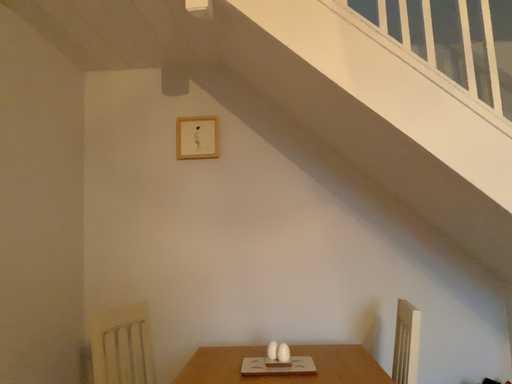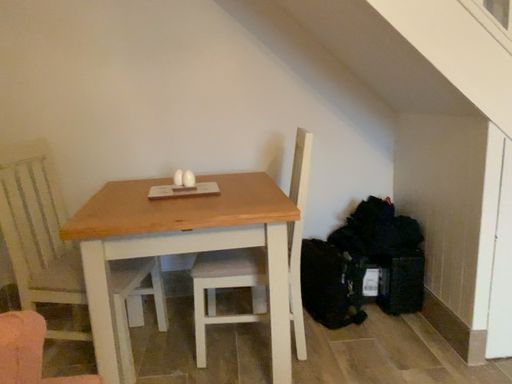
Question: Which way did the camera rotate in the video?

Choices:
 (A) rotated downward
 (B) rotated upward

Answer: (A)